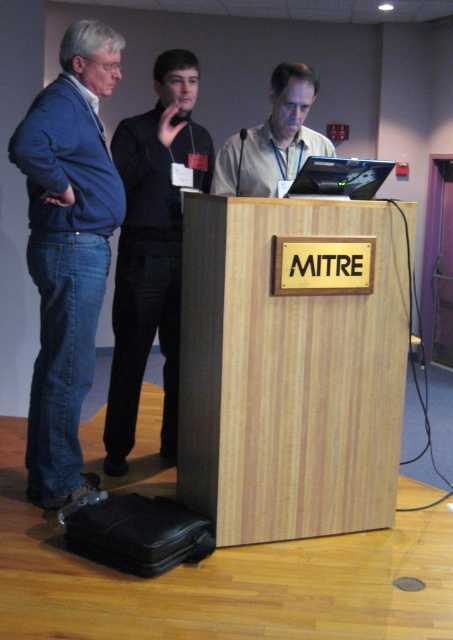
Based on the scene description, what object is located at the coordinate point (67, 250)?

The blue denim jeans at left are located at the coordinate point (67, 250).

From the picture: You are standing at the entrance of the conference room. You need to approach the wooden podium at center to retrieve a document. Based on the coordinates provided, in which direction should you move relative to your current position?

The wooden podium at center is located at coordinates point (x=289, y=374), so you should move towards the center of the room to reach it.